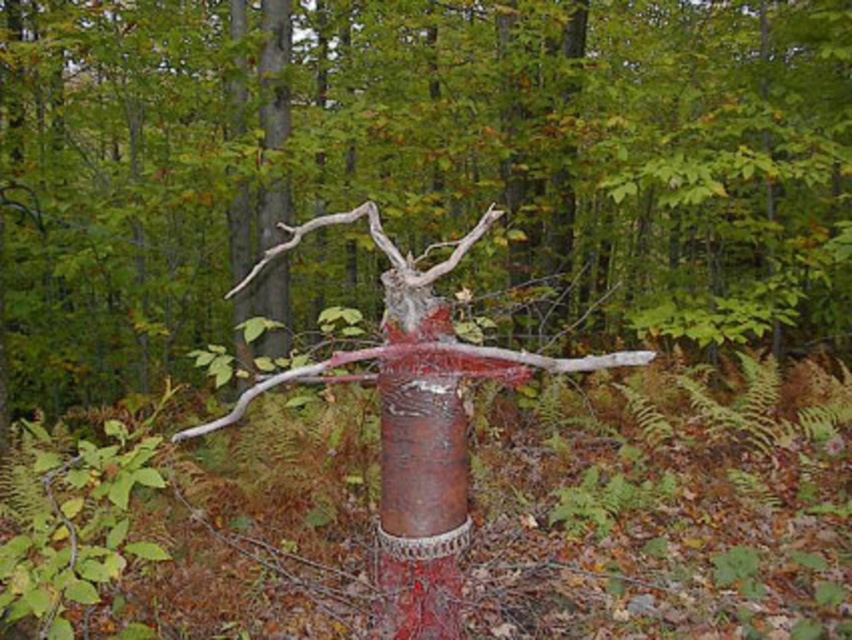
You are a hiker who wants to take a photo of both the rusty metal tree at center and the rusty metal pole at center. Since you have a camera with a fixed focal length, you need to adjust your distance to ensure both objects fit in the frame. Which object should you move closer to or farther away from to include both in your photo?

Since the rusty metal tree at center is smaller than the rusty metal pole at center, you should move closer to the rusty metal tree at center to ensure both objects fit in the frame. Moving closer will make the smaller tree appear larger relative to the pole, balancing their sizes in the photo.

structural integrity of the installation is a concern. The rusty metal pole at center and rusty metal branch at center are both part of the installation. Which object is more to the right, and could this placement affect the balance of the structure?

structural integrity of the installation is a concern. The rusty metal pole at center and rusty metal branch at center are both part of the installation. Which object is more to the right, and could this placement affect the balance of the structure? The rusty metal pole at center is positioned on the right side of rusty metal branch at center. This placement could affect the balance of the structure since the pole is shifted to the right, potentially creating an uneven weight distribution.